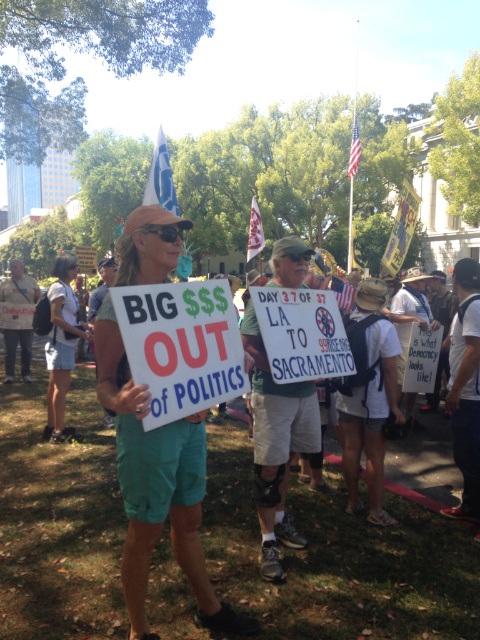
Can you confirm if teal fabric shorts at center is positioned above denim shorts at lower left?

No.

Is point (126, 481) closer to viewer compared to point (50, 422)?

Yes, point (126, 481) is in front of point (50, 422).

Where is `teal fabric shorts at center`? Image resolution: width=480 pixels, height=640 pixels. teal fabric shorts at center is located at coordinates (156, 486).